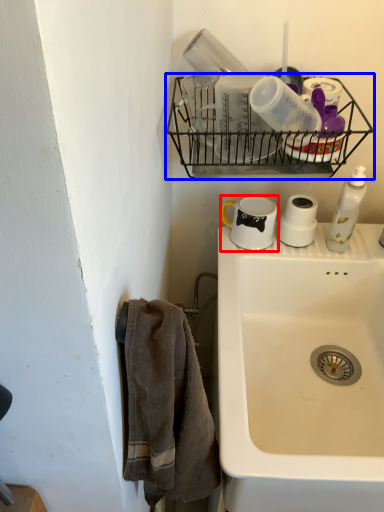
Question: Which point is further to the camera, coffee cup (highlighted by a red box) or shelf (highlighted by a blue box)?

Choices:
 (A) coffee cup
 (B) shelf

Answer: (A)